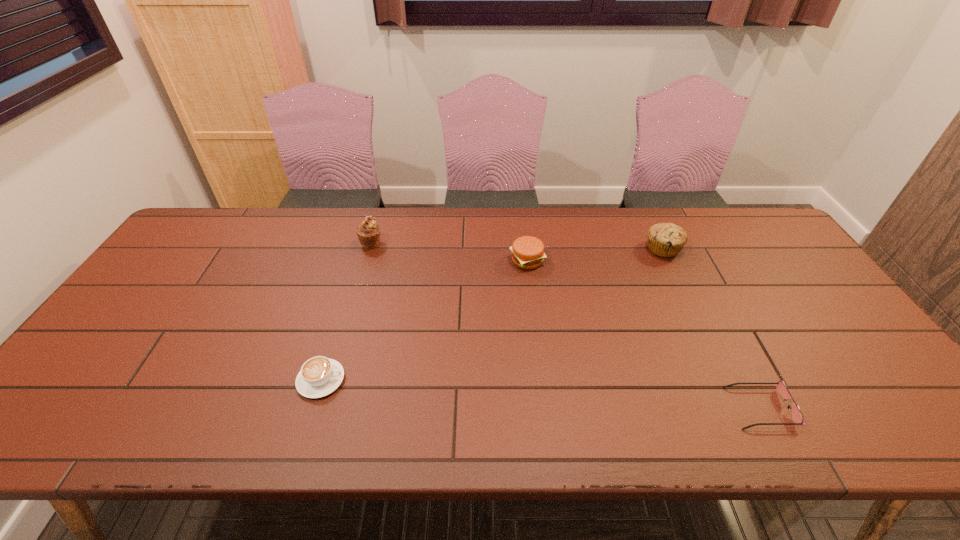
Where is `vacant space located on the bridge of the shortest object`? The width and height of the screenshot is (960, 540). vacant space located on the bridge of the shortest object is located at coordinates (683, 408).

Where is `vacant space located on the bridge of the shortest object`? The height and width of the screenshot is (540, 960). vacant space located on the bridge of the shortest object is located at coordinates (620, 408).

At what (x,y) coordinates should I click in order to perform the action: click on free space located on the bridge of the shortest object. Please return your answer as a coordinate pair (x, y). The height and width of the screenshot is (540, 960). Looking at the image, I should click on coord(580,408).

At what (x,y) coordinates should I click in order to perform the action: click on hamburger that is positioned at the far edge. Please return your answer as a coordinate pair (x, y). This screenshot has height=540, width=960. Looking at the image, I should click on (527, 252).

Image resolution: width=960 pixels, height=540 pixels. What are the coordinates of `object that is positioned at the near edge` in the screenshot? It's located at (797, 417).

This screenshot has height=540, width=960. In order to click on free point at the far edge in this screenshot , I will do `click(573, 221)`.

At what (x,y) coordinates should I click in order to perform the action: click on vacant space at the near edge of the desktop. Please return your answer as a coordinate pair (x, y). Looking at the image, I should click on (126, 426).

In the image, there is a desktop. Identify the location of vacant space at the left edge. (77, 387).

This screenshot has height=540, width=960. In order to click on vacant area at the right edge in this screenshot , I will do `click(804, 281)`.

The image size is (960, 540). Identify the location of vacant space at the far left corner of the desktop. (222, 238).